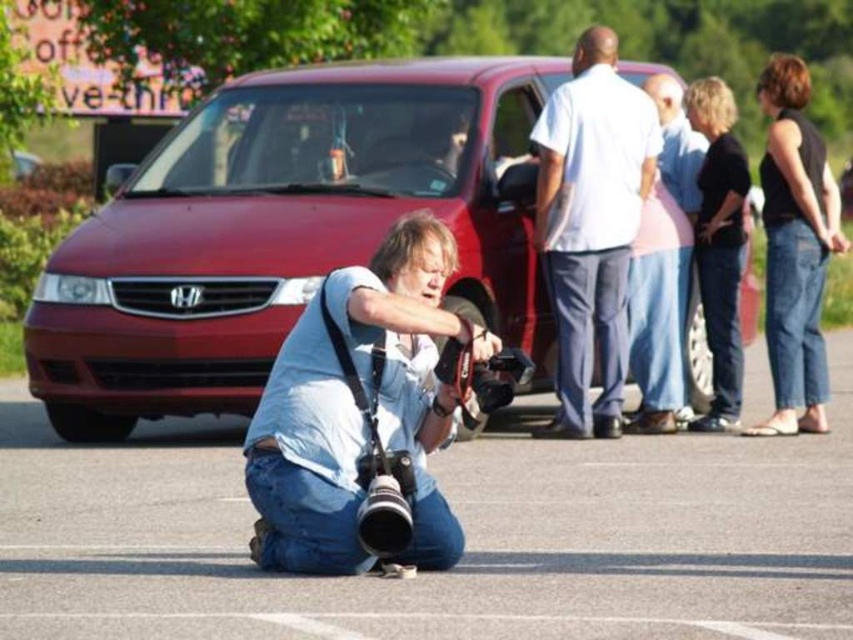
Question: Which point is closer to the camera?

Choices:
 (A) (616, 54)
 (B) (642, 308)
 (C) (302, 355)
 (D) (486, 237)

Answer: (C)

Question: From the image, what is the correct spatial relationship of matte black camera at lower center in relation to black denim jeans at right?

Choices:
 (A) right
 (B) left

Answer: (B)

Question: Is white cotton shirt at upper center further to the viewer compared to pink cotton shirt at center?

Choices:
 (A) no
 (B) yes

Answer: (A)

Question: Which point is closer to the camera?

Choices:
 (A) (840, 422)
 (B) (695, 164)

Answer: (B)

Question: Which object appears farthest from the camera in this image?

Choices:
 (A) white cotton shirt at upper center
 (B) matte black camera at lower center
 (C) black denim jeans at right

Answer: (C)

Question: Is matte red van at center positioned before white cotton shirt at upper center?

Choices:
 (A) no
 (B) yes

Answer: (B)